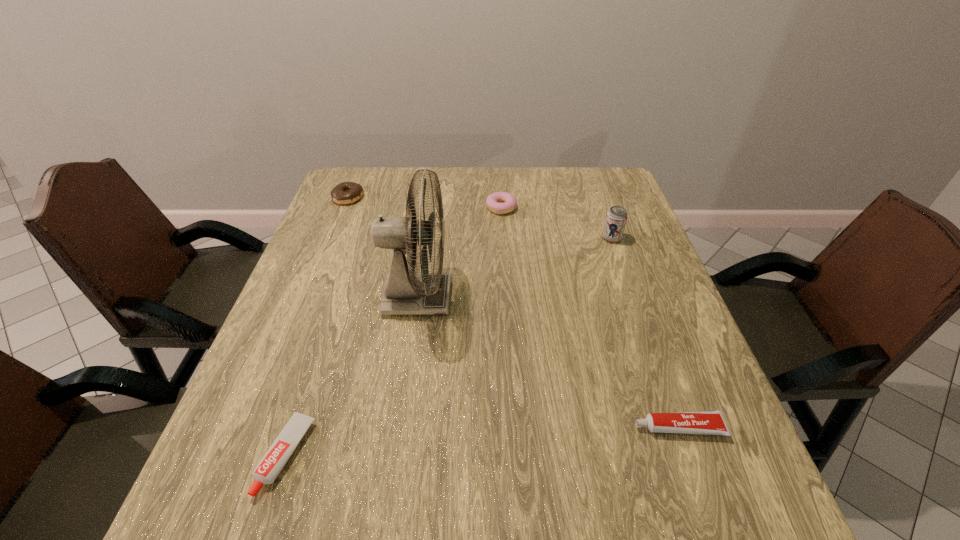
At what (x,y) coordinates should I click in order to perform the action: click on object present at the far left corner. Please return your answer as a coordinate pair (x, y). The image size is (960, 540). Looking at the image, I should click on (346, 192).

This screenshot has width=960, height=540. What are the coordinates of `object located at the near left corner` in the screenshot? It's located at (278, 454).

You are a GUI agent. You are given a task and a screenshot of the screen. Output one action in this format:
    pyautogui.click(x=<x>, y=<y>)
    Task: Click on the vacant area at the far edge
    
    Given the screenshot: What is the action you would take?
    pyautogui.click(x=567, y=197)

In the image, there is a desktop. Identify the location of vacant space at the near edge. (612, 497).

In the image, there is a desktop. Identify the location of vacant space at the left edge. The width and height of the screenshot is (960, 540). (356, 278).

The height and width of the screenshot is (540, 960). Find the location of `free region at the right edge of the desktop`. free region at the right edge of the desktop is located at coordinates (740, 476).

In the image, there is a desktop. Where is `free space at the far right corner`? This screenshot has width=960, height=540. free space at the far right corner is located at coordinates (604, 196).

Where is `free space between the fifth shortest object and the right toothpaste`? This screenshot has width=960, height=540. free space between the fifth shortest object and the right toothpaste is located at coordinates (645, 333).

Identify the location of vacant area that lies between the left toothpaste and the beer can. (449, 347).

Image resolution: width=960 pixels, height=540 pixels. In order to click on empty space between the left doughnut and the third farthest object in this screenshot , I will do `click(480, 218)`.